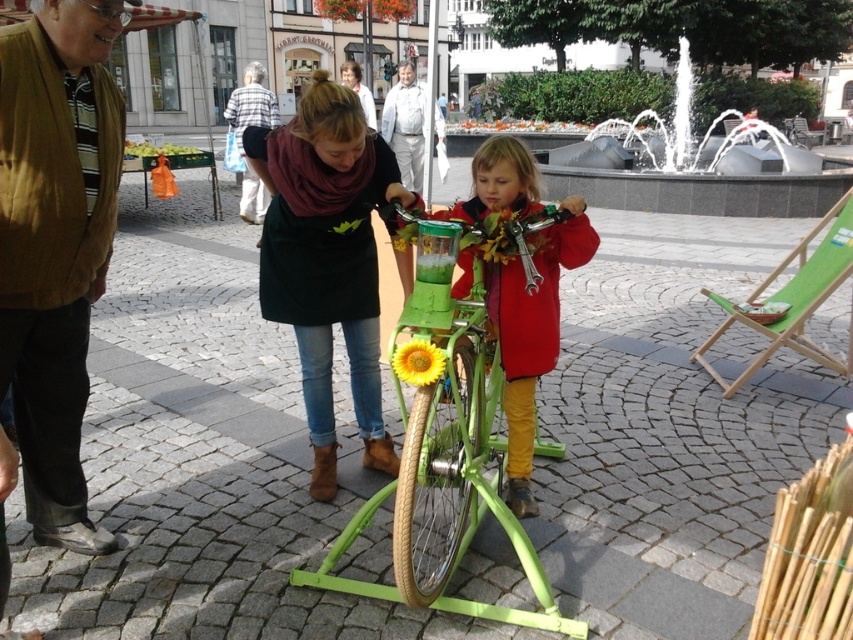
Is matte black shirt at center positioned before green matte bicycle at center?

That is False.

Between matte black shirt at center and green matte bicycle at center, which one has more height?

With more height is matte black shirt at center.

This screenshot has width=853, height=640. I want to click on matte black shirt at center, so click(x=328, y=259).

Identify the location of matte black shirt at center. The image size is (853, 640). (328, 259).

Is green matte bicycle at center positioned in front of yellow matte sunflower at center?

Yes, it is.

Does point (451, 308) come closer to viewer compared to point (393, 365)?

No, it is not.

Identify the location of green matte bicycle at center. Image resolution: width=853 pixels, height=640 pixels. (450, 403).

Can you confirm if matte black shirt at center is wider than white stone fountain at upper center?

No.

Can you confirm if matte black shirt at center is thinner than white stone fountain at upper center?

Yes, matte black shirt at center is thinner than white stone fountain at upper center.

Does point (285, 236) lie behind point (659, 161)?

No.

Find the location of a particular element. Image resolution: width=853 pixels, height=640 pixels. matte black shirt at center is located at coordinates (328, 259).